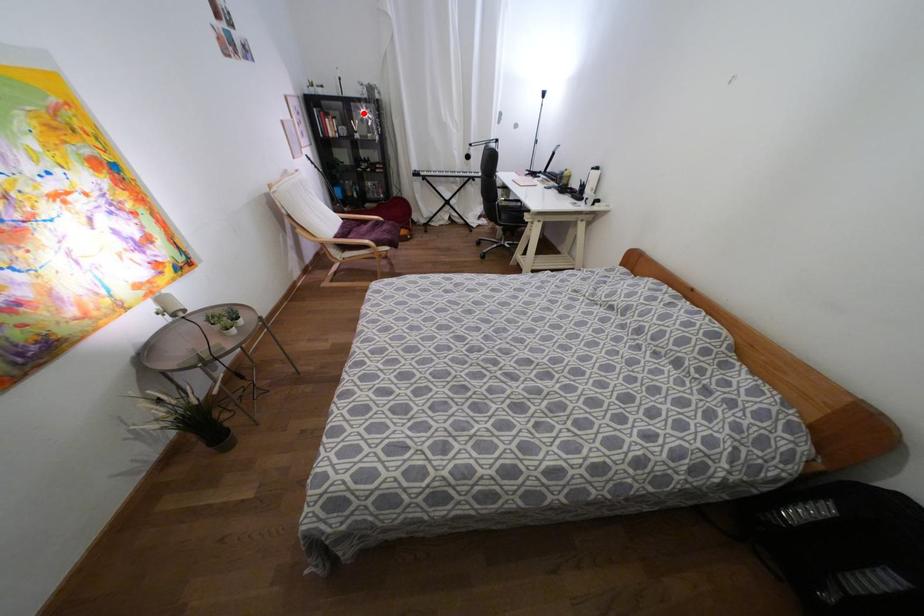
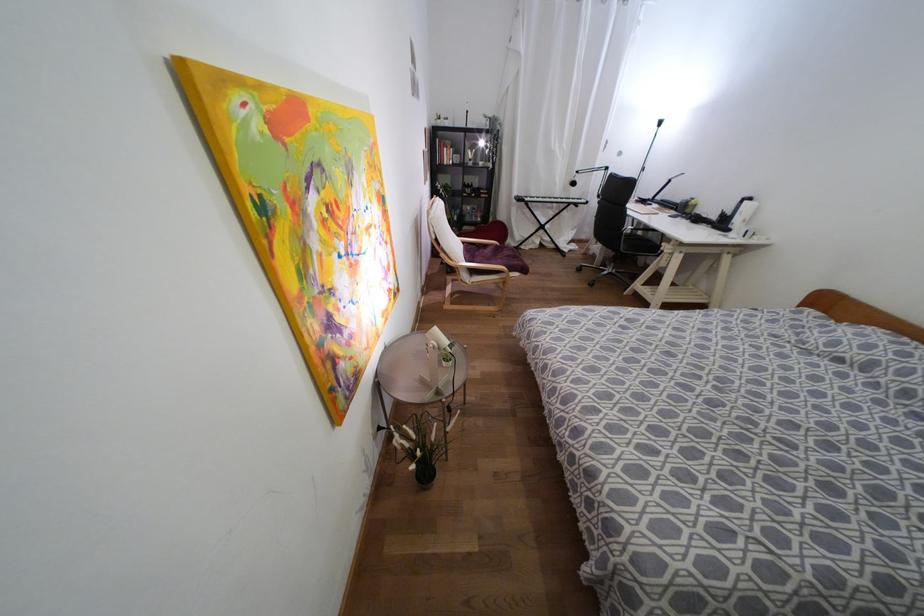
Find the pixel in the second image that matches the highlighted location in the first image.

(480, 143)